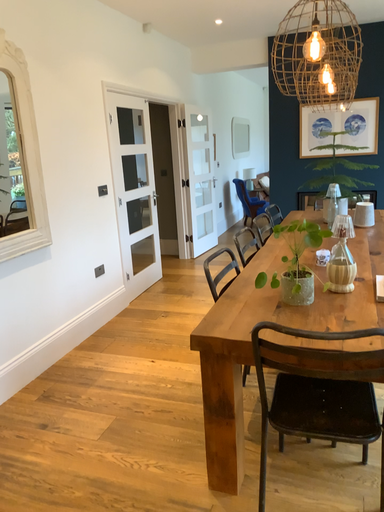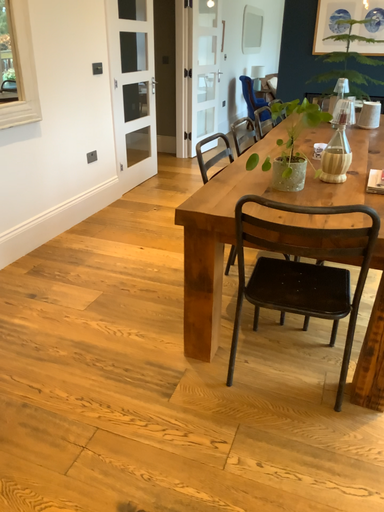
Question: Which way did the camera rotate in the video?

Choices:
 (A) rotated upward
 (B) rotated downward

Answer: (B)